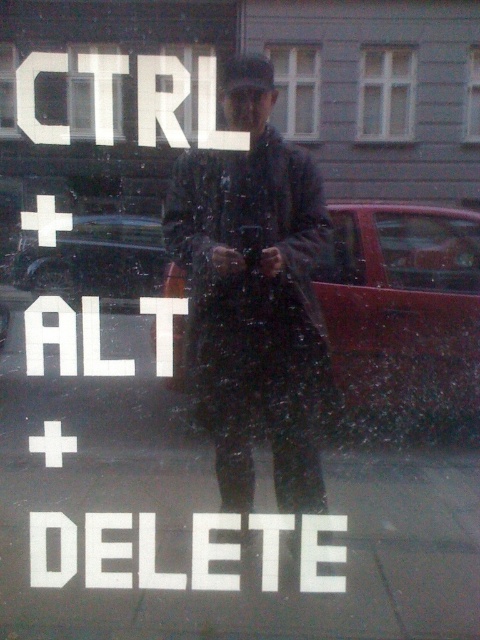
The height and width of the screenshot is (640, 480). I want to click on dark matte coat at center, so click(253, 294).

Is point (257, 316) positioned behind point (470, 140)?

Yes, point (257, 316) is farther from viewer.

Identify the location of dark matte coat at center. (253, 294).

Locate an element on the screen. Image resolution: width=480 pixels, height=640 pixels. white plastic window at upper center is located at coordinates (385, 93).

Can you confirm if white plastic window at upper center is wider than transparent glass window at upper center?

Correct, the width of white plastic window at upper center exceeds that of transparent glass window at upper center.

Measure the distance between point (x=374, y=81) and camera.

Point (x=374, y=81) is 4.92 feet from camera.

Image resolution: width=480 pixels, height=640 pixels. What are the coordinates of `white plastic window at upper center` in the screenshot? It's located at (385, 93).

Is point (179, 186) positioned before point (309, 77)?

That is False.

What are the coordinates of `dark matte coat at center` in the screenshot? It's located at (253, 294).

Is point (244, 460) less distant than point (301, 83)?

No.

Identify the location of dark matte coat at center. (253, 294).